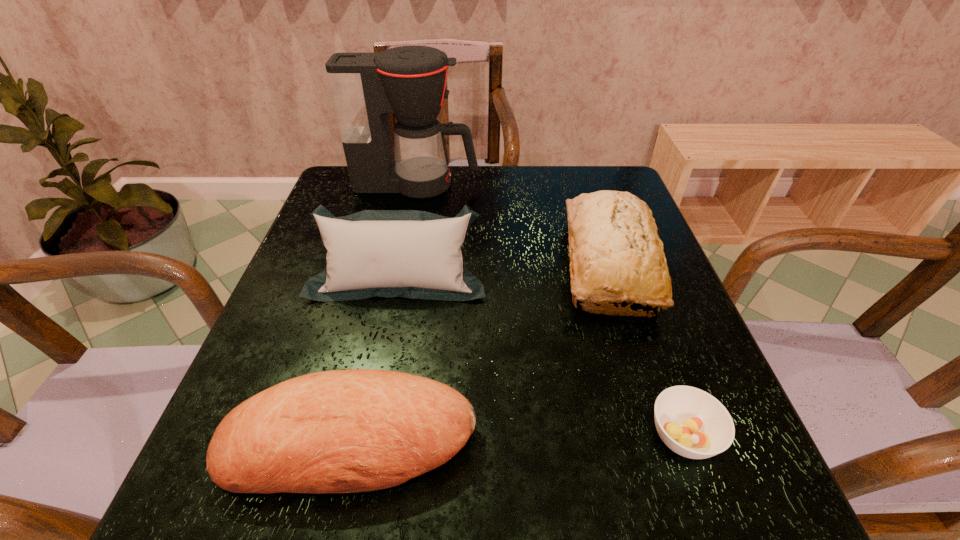
In order to click on the farthest object in this screenshot , I will do `click(409, 82)`.

Locate an element on the screen. Image resolution: width=960 pixels, height=540 pixels. coffee maker is located at coordinates (409, 82).

Identify the location of cushion. The width and height of the screenshot is (960, 540). (414, 254).

The height and width of the screenshot is (540, 960). Identify the location of the right bread. (613, 242).

Locate an element on the screen. This screenshot has width=960, height=540. the taller bread is located at coordinates (613, 242).

Where is `the shorter bread`? Image resolution: width=960 pixels, height=540 pixels. the shorter bread is located at coordinates (343, 431).

You are a GUI agent. You are given a task and a screenshot of the screen. Output one action in this format:
    pyautogui.click(x=<x>, y=<y>)
    Task: Click on the nearer bread
    The width and height of the screenshot is (960, 540).
    Given the screenshot: What is the action you would take?
    pyautogui.click(x=343, y=431)

At what (x,y) coordinates should I click in order to perform the action: click on the shortest object. Please return your answer as a coordinate pair (x, y). The width and height of the screenshot is (960, 540). Looking at the image, I should click on (691, 422).

Find the location of a particular element. Image resolution: width=960 pixels, height=540 pixels. vacant space located pour from the carafe of the farthest object is located at coordinates (503, 185).

This screenshot has width=960, height=540. In order to click on vacant space located 0.400m on the surface of the cushion in this screenshot , I will do `click(351, 513)`.